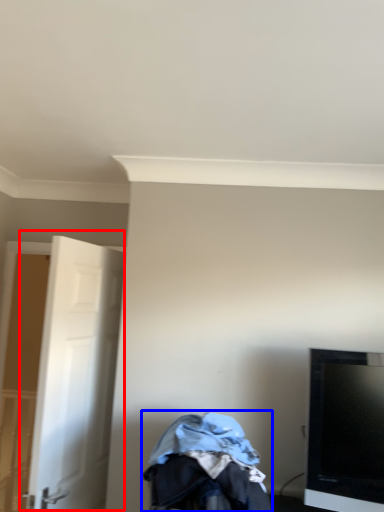
Question: Among these objects, which one is nearest to the camera, door (highlighted by a red box) or baby carriage (highlighted by a blue box)?

Choices:
 (A) door
 (B) baby carriage

Answer: (B)